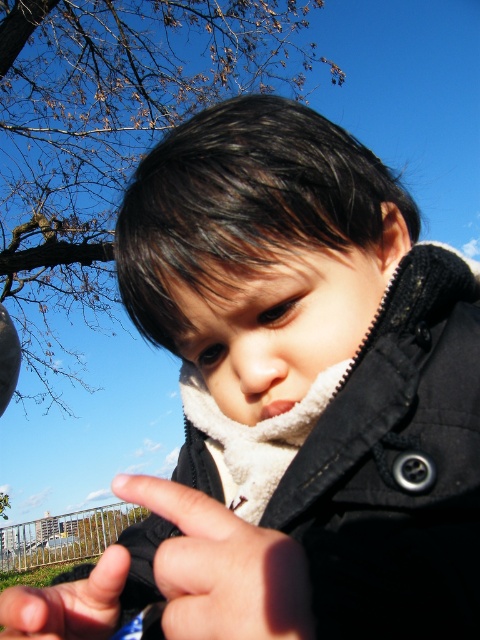
Is point (152, 497) positioned in front of point (118, 589)?

Yes, point (152, 497) is closer to viewer.

Where is `smooth black glove at center`? Image resolution: width=480 pixels, height=640 pixels. smooth black glove at center is located at coordinates (222, 566).